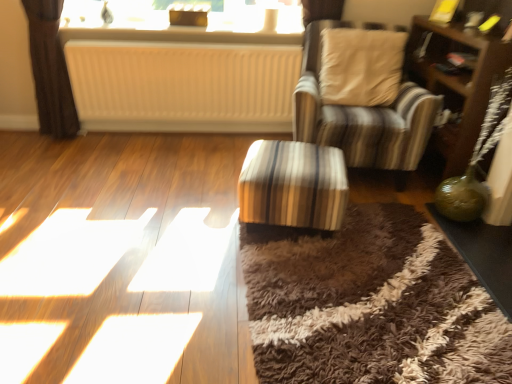
Identify the location of vacant area that lies between striped fabric ottoman at center, positioned as the 2th table in right-to-left order, and green glass table at lower right, arranged as the first table when viewed from the right. The height and width of the screenshot is (384, 512). (400, 248).